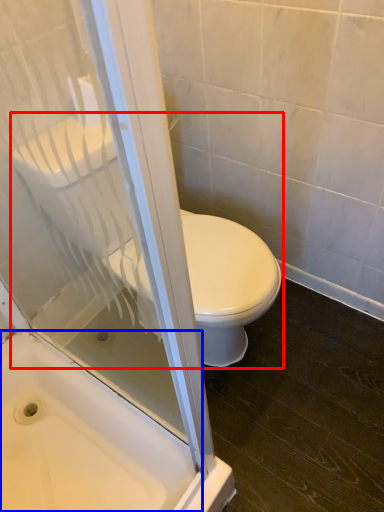
Question: Which object appears farthest to the camera in this image, toilet (highlighted by a red box) or bath (highlighted by a blue box)?

Choices:
 (A) toilet
 (B) bath

Answer: (B)